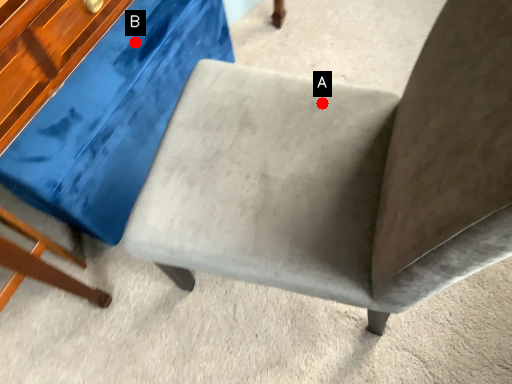
Question: Two points are circled on the image, labeled by A and B beside each circle. Which point is closer to the camera?

Choices:
 (A) A is closer
 (B) B is closer

Answer: (A)